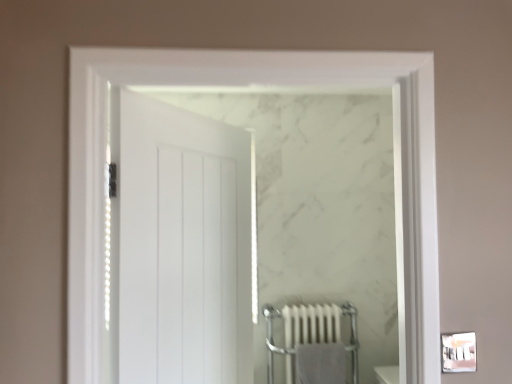
What are the coordinates of `free space above white metallic radiator at lower center (from a real-world perspective)` in the screenshot? It's located at (315, 307).